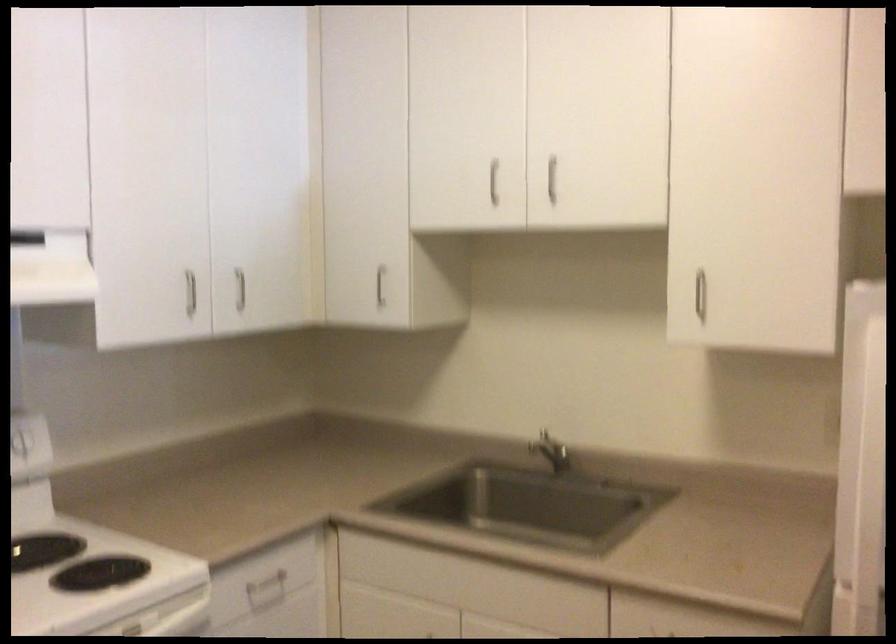
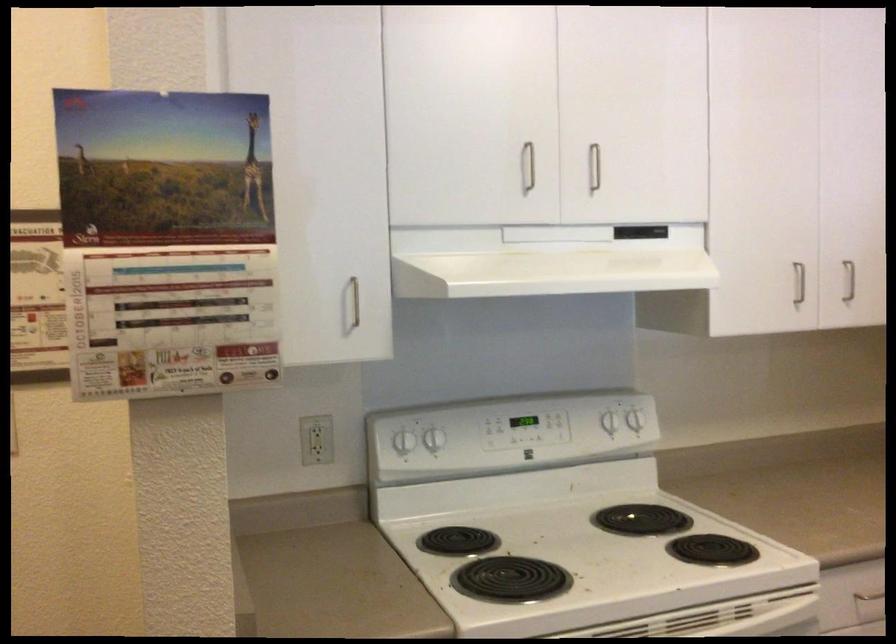
The point at (186, 288) is marked in the first image. Where is the corresponding point in the second image?

(798, 283)